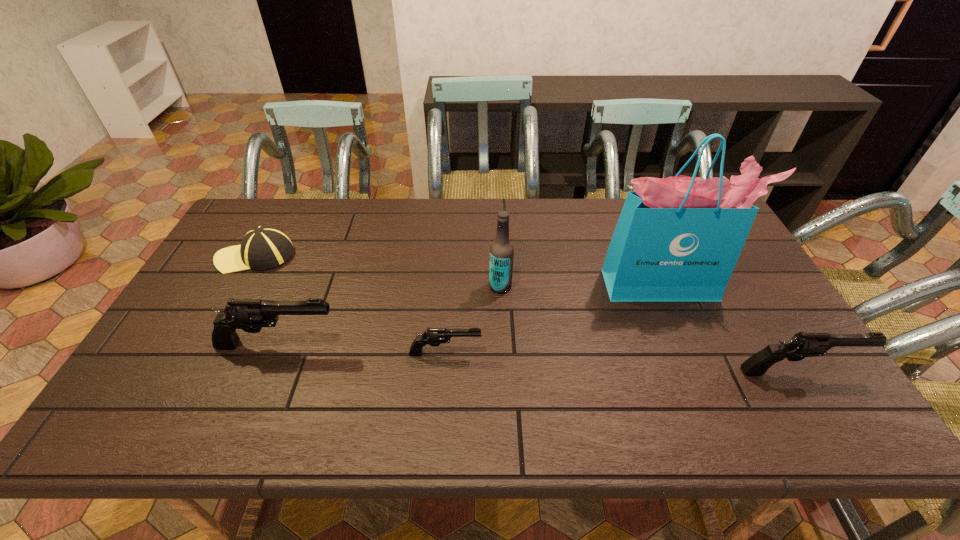
To achieve uniform spacing by inserting another gun among them, please point to a free space for this new gun. Please provide its 2D coordinates. Your answer should be formatted as a tuple, i.e. [(x, y)], where the tuple contains the x and y coordinates of a point satisfying the conditions above.

[(618, 362)]